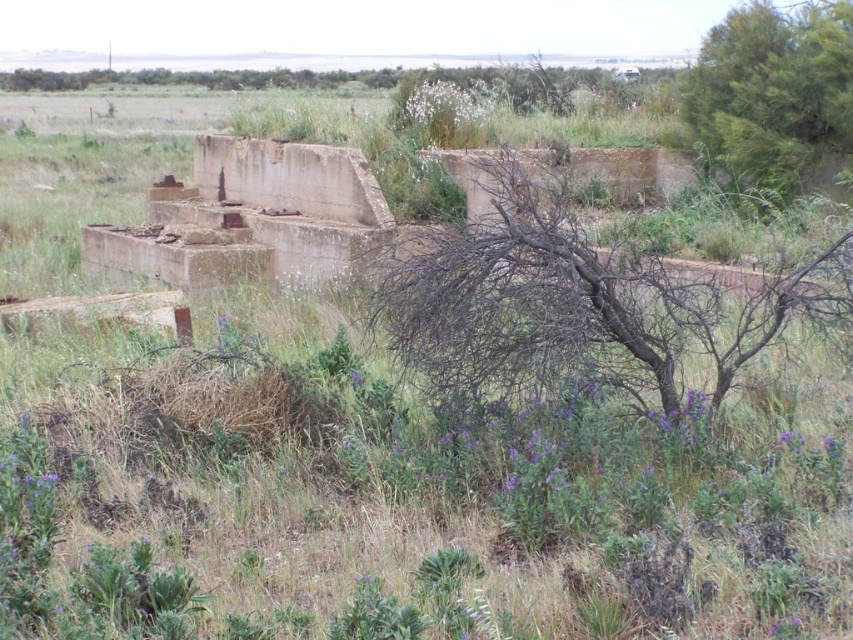
Is point (553, 365) farther from viewer compared to point (822, 17)?

No.

Which is below, brown dry branches at center or green leafy tree at upper right?

brown dry branches at center is below.

This screenshot has height=640, width=853. I want to click on brown dry branches at center, so click(x=582, y=300).